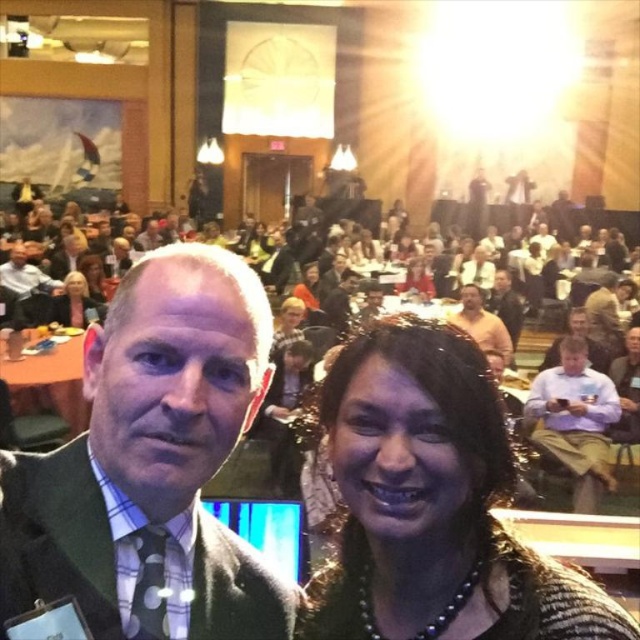
You are standing at the entrance of the hall and want to find the green wool suit at center. According to the coordinates provided, in which direction should you look relative to your position?

The green wool suit at center is located at coordinates point (150, 465), which means it is positioned to the right and slightly forward from your current position at the entrance.